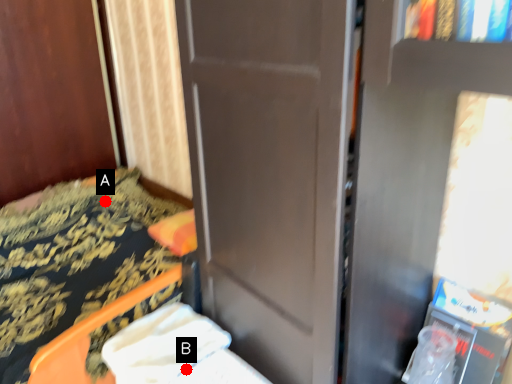
Question: Two points are circled on the image, labeled by A and B beside each circle. Which point is farther to the camera?

Choices:
 (A) A is further
 (B) B is further

Answer: (A)